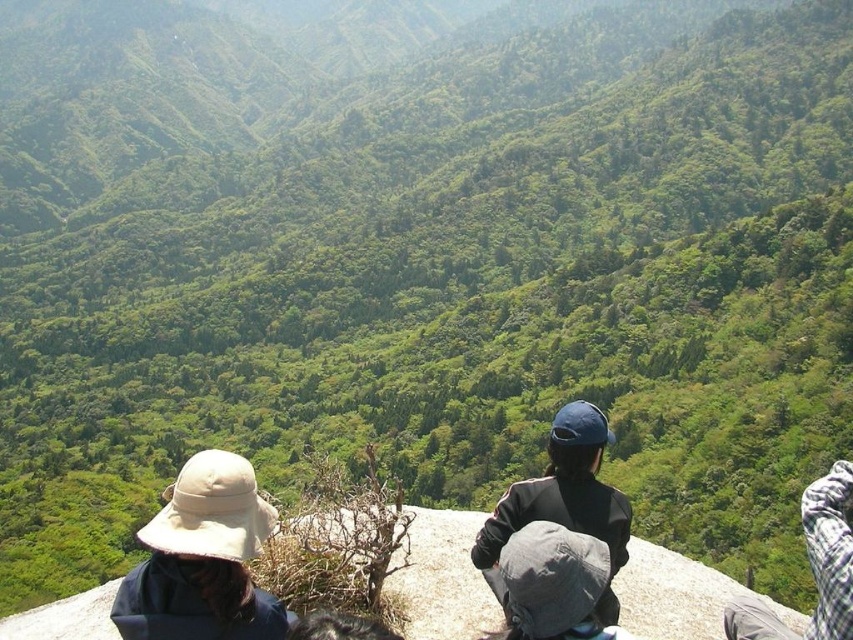
Does gray fabric hat at center appear on the right side of plaid fabric scarf at lower right?

In fact, gray fabric hat at center is to the left of plaid fabric scarf at lower right.

You are a GUI agent. You are given a task and a screenshot of the screen. Output one action in this format:
    pyautogui.click(x=<x>, y=<y>)
    Task: Click on the gray fabric hat at center
    Image resolution: width=853 pixels, height=640 pixels.
    Given the screenshot: What is the action you would take?
    pyautogui.click(x=555, y=582)

Between beige fabric hat at lower left and gray fabric hat at center, which one has less height?

With less height is gray fabric hat at center.

In order to click on beige fabric hat at lower left in this screenshot , I will do `click(202, 560)`.

At what (x,y) coordinates should I click in order to perform the action: click on beige fabric hat at lower left. Please return your answer as a coordinate pair (x, y). Looking at the image, I should click on [x=202, y=560].

Can you confirm if beige fabric hat at lower left is positioned to the left of plaid fabric scarf at lower right?

Yes, beige fabric hat at lower left is to the left of plaid fabric scarf at lower right.

Which is below, beige fabric hat at lower left or plaid fabric scarf at lower right?

plaid fabric scarf at lower right is below.

Locate an element on the screen. Image resolution: width=853 pixels, height=640 pixels. beige fabric hat at lower left is located at coordinates (202, 560).

The height and width of the screenshot is (640, 853). I want to click on beige fabric hat at lower left, so [202, 560].